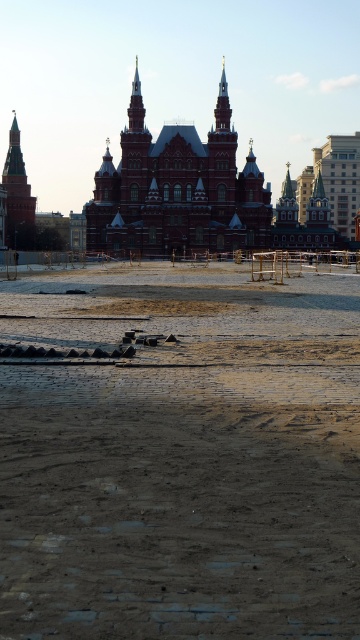
Question: Is red brick building at center to the right of brick tower at left from the viewer's perspective?

Choices:
 (A) no
 (B) yes

Answer: (B)

Question: Which is farther from the red brick building at center?

Choices:
 (A) brown sandy ground at center
 (B) brick tower at left

Answer: (B)

Question: Which of these objects is positioned closest to the brown sandy ground at center?

Choices:
 (A) red brick building at center
 (B) brick tower at left

Answer: (A)

Question: Does red brick building at center lie in front of brick tower at left?

Choices:
 (A) no
 (B) yes

Answer: (B)

Question: Can you confirm if red brick building at center is thinner than brick tower at left?

Choices:
 (A) no
 (B) yes

Answer: (A)

Question: Which point is closer to the camera taking this photo?

Choices:
 (A) (9, 157)
 (B) (218, 481)

Answer: (B)